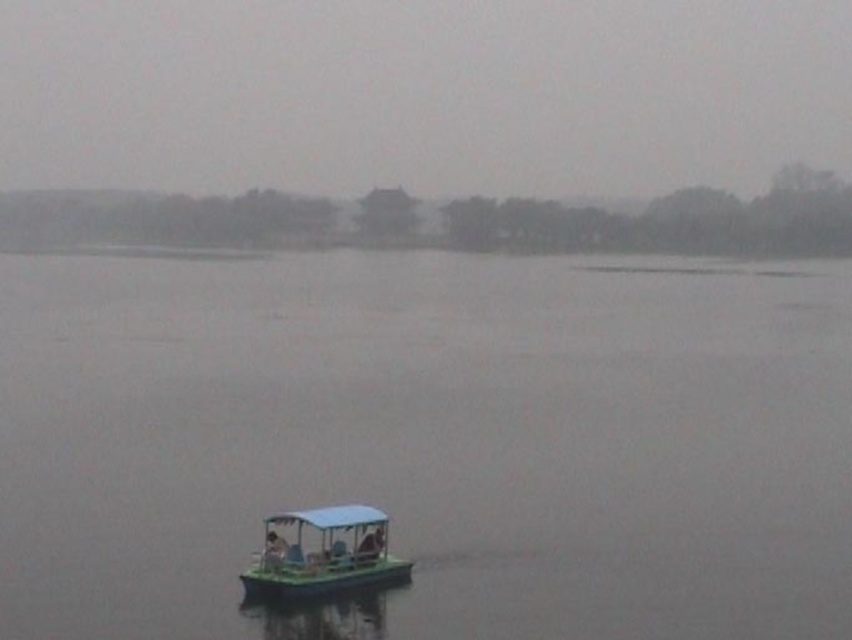
Describe the element at coordinates (430, 440) in the screenshot. I see `green plastic boat at center` at that location.

Locate an element on the screen. green plastic boat at center is located at coordinates (430, 440).

Does point (686, 305) come closer to viewer compared to point (367, 566)?

That is False.

Where is `green plastic boat at center`? green plastic boat at center is located at coordinates pyautogui.click(x=430, y=440).